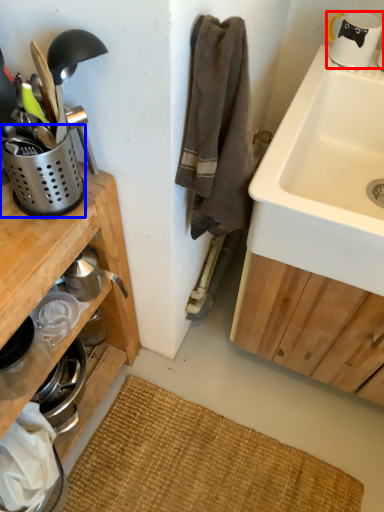
Question: Which object is closer to the camera taking this photo, coffee cup (highlighted by a red box) or appliance (highlighted by a blue box)?

Choices:
 (A) coffee cup
 (B) appliance

Answer: (B)